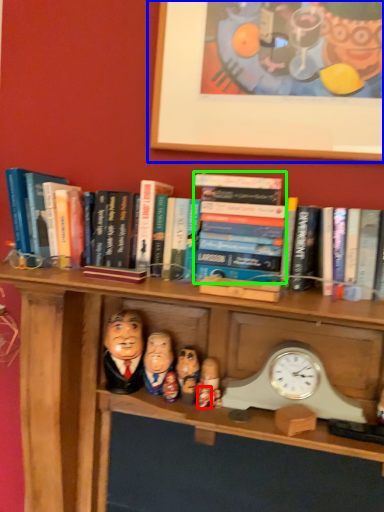
Question: Estimate the real-world distances between objects in this image. Which object is farther from toy (highlighted by a red box), picture frame (highlighted by a blue box) or paperback book (highlighted by a green box)?

Choices:
 (A) picture frame
 (B) paperback book

Answer: (A)